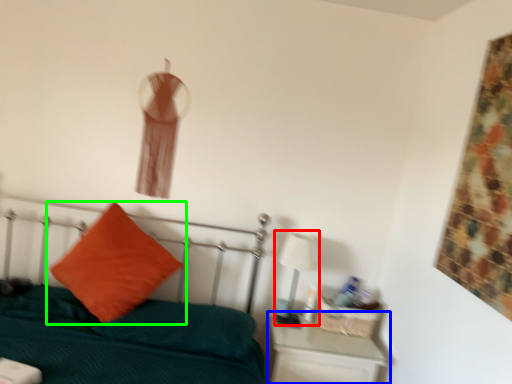
Question: Based on their relative distances, which object is nearer to table lamp (highlighted by a red box)? Choose from nightstand (highlighted by a blue box) and pillow (highlighted by a green box).

Choices:
 (A) nightstand
 (B) pillow

Answer: (A)